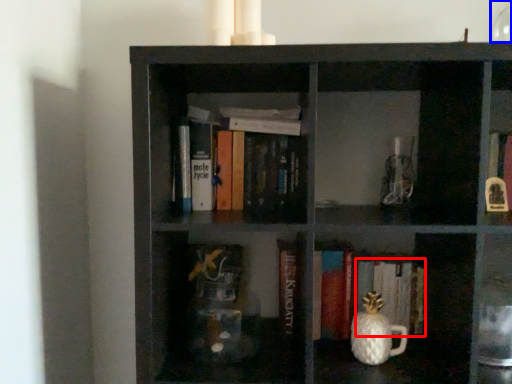
Question: Which of the following is the farthest to the observer, book (highlighted by a red box) or glass vase (highlighted by a blue box)?

Choices:
 (A) book
 (B) glass vase

Answer: (A)